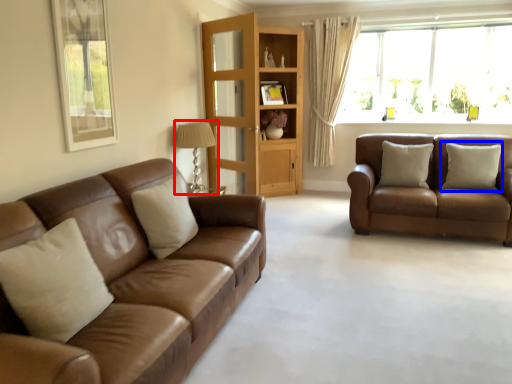
Question: Which object appears farthest to the camera in this image, lamp (highlighted by a red box) or pillow (highlighted by a blue box)?

Choices:
 (A) lamp
 (B) pillow

Answer: (B)